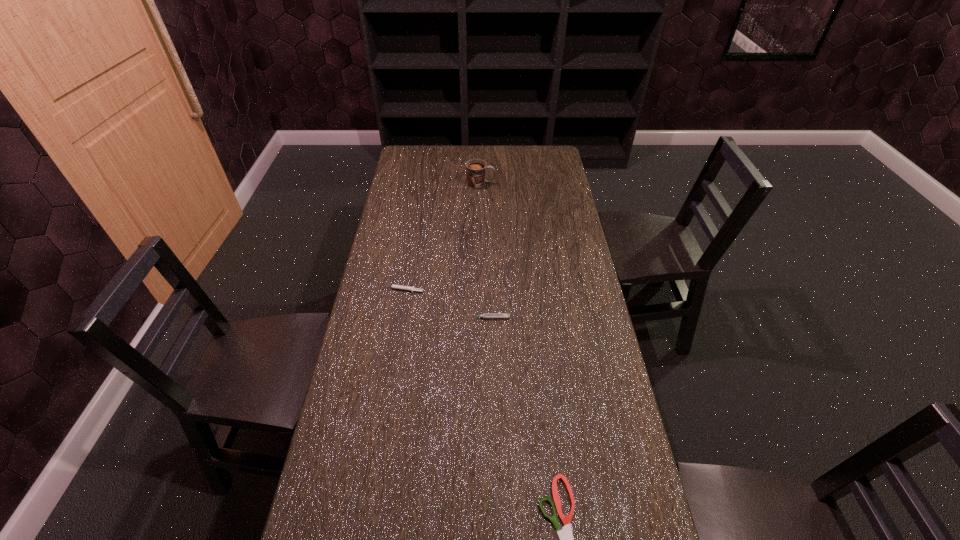
Identify the location of empty space between the taller syringe and the farther syringe. The height and width of the screenshot is (540, 960). (445, 304).

Locate an element on the screen. Image resolution: width=960 pixels, height=540 pixels. the third closest object to the second nearest object is located at coordinates (475, 169).

Identify which object is the second closest to the shorter syringe. Please provide its 2D coordinates. Your answer should be formatted as a tuple, i.e. [(x, y)], where the tuple contains the x and y coordinates of a point satisfying the conditions above.

[(475, 169)]